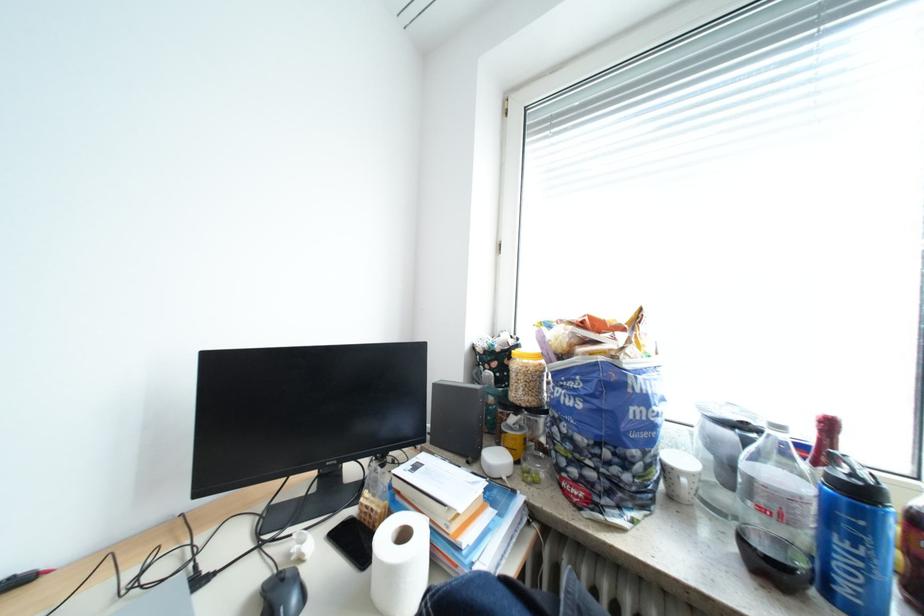
Where would you lift the white paper roll? Please return your answer as a coordinate pair (x, y).

(399, 562)